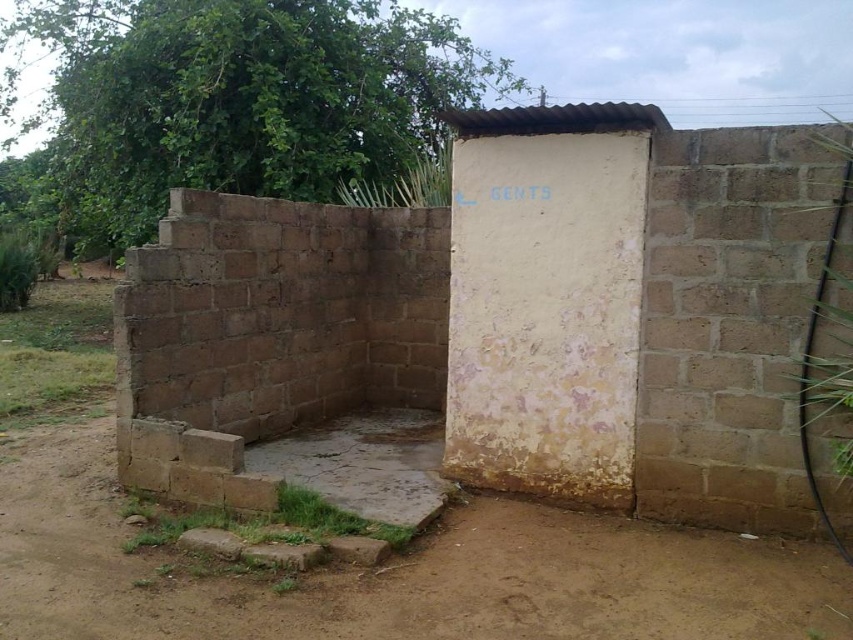
Based on the photo, you are standing at the point marked as point [704,170] in the image. You want to walk to the restroom entrance which is 3 meters away from your current position. Can you reach the entrance without moving more than 3 meters?

The distance between point [704,170] and the viewer is 4.13 meters. Since the restroom entrance is 3 meters away from your current position, you would need to move 4.13 meters to reach it, which is more than the 3 meters allowed. Therefore, you cannot reach the entrance without moving more than 3 meters.